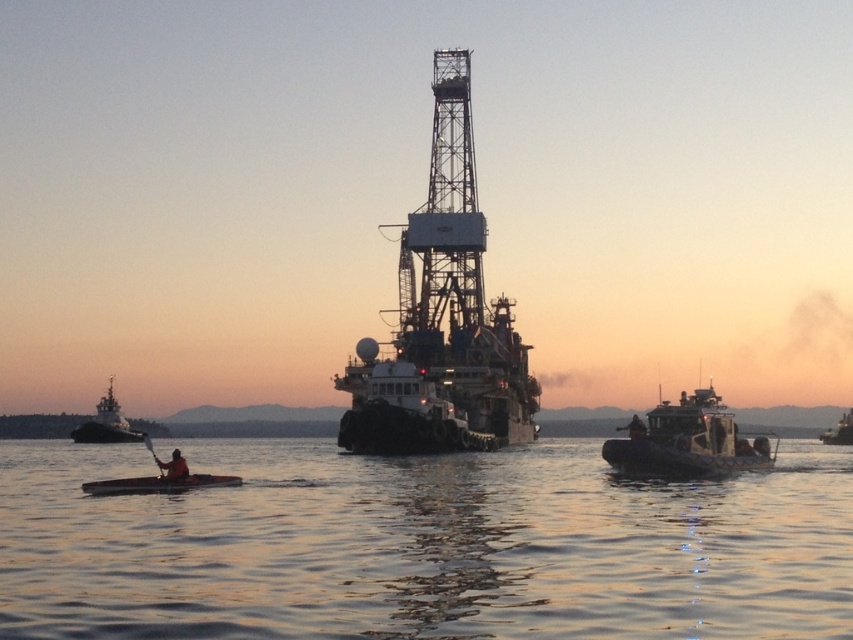
You are a sailor who needs to retrieve a paddle from the dark brown wooden paddle at lower left to reach the green rubber boat at right. Can you reach the boat from where the paddle is located?

The green rubber boat at right is to the right of the dark brown wooden paddle at lower left, so yes, you can reach the boat by moving towards the right from the paddle.

You are an observer on the smooth wood canoe at lower left and want to get to the brushed metal tugboat at left. Which direction should you paddle to reach it?

The smooth wood canoe at lower left is to the right of the brushed metal tugboat at left. To reach the tugboat, you should paddle to the left.

You are observing the scene from the camera position. There are two points marked in the image, point 1 at coordinates point [157,481] and point 2 at coordinates point [100,416]. Which point is nearer to you?

Point [157,481] is closer to the camera than point [100,416].